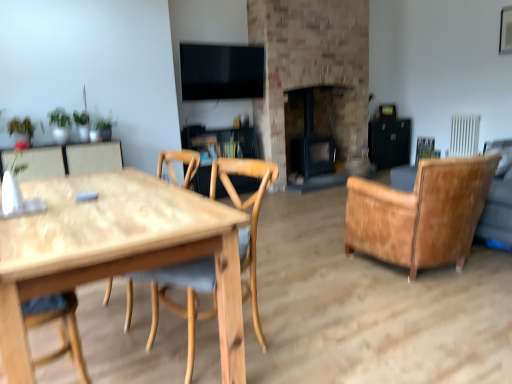
Question: From the image's perspective, is natural wood chair at center, which ranks as the first chair in left-to-right order, on top of natural wood table at left?

Choices:
 (A) no
 (B) yes

Answer: (B)

Question: Is natural wood chair at center, which is the 1th chair in front-to-back order, not near natural wood table at left?

Choices:
 (A) no
 (B) yes

Answer: (A)

Question: From a real-world perspective, is natural wood chair at center, which is the 2th chair from back to front, physically below natural wood table at left?

Choices:
 (A) yes
 (B) no

Answer: (B)

Question: Is natural wood chair at center, positioned as the 2th chair in right-to-left order, thinner than natural wood table at left?

Choices:
 (A) no
 (B) yes

Answer: (B)

Question: Is natural wood table at left at the back of natural wood chair at center, positioned as the 2th chair in right-to-left order?

Choices:
 (A) yes
 (B) no

Answer: (B)

Question: Is the depth of natural wood chair at center, which is the 2th chair from back to front, less than that of natural wood table at left?

Choices:
 (A) yes
 (B) no

Answer: (B)

Question: Can you confirm if brick fireplace at center, arranged as the first fireplace when viewed from the right, is bigger than natural wood table at left?

Choices:
 (A) yes
 (B) no

Answer: (A)

Question: From the image's perspective, is brick fireplace at center, arranged as the first fireplace when viewed from the right, beneath natural wood table at left?

Choices:
 (A) yes
 (B) no

Answer: (B)

Question: From a real-world perspective, is brick fireplace at center, arranged as the first fireplace when viewed from the right, beneath natural wood table at left?

Choices:
 (A) no
 (B) yes

Answer: (A)

Question: Can you confirm if brick fireplace at center, arranged as the first fireplace when viewed from the right, is thinner than natural wood table at left?

Choices:
 (A) yes
 (B) no

Answer: (A)

Question: Is brick fireplace at center, arranged as the 2th fireplace when viewed from the left, shorter than natural wood table at left?

Choices:
 (A) no
 (B) yes

Answer: (A)

Question: Can you confirm if brick fireplace at center, arranged as the 2th fireplace when viewed from the left, is wider than natural wood table at left?

Choices:
 (A) yes
 (B) no

Answer: (B)

Question: Does brick fireplace at center, arranged as the first fireplace when viewed from the right, have a lesser width compared to black matte fireplace at center, which ranks as the second fireplace in right-to-left order?

Choices:
 (A) no
 (B) yes

Answer: (A)